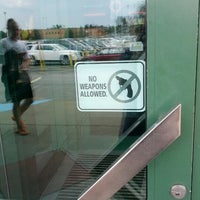
This screenshot has height=200, width=200. I want to click on silver circular door lock, so click(x=183, y=191).